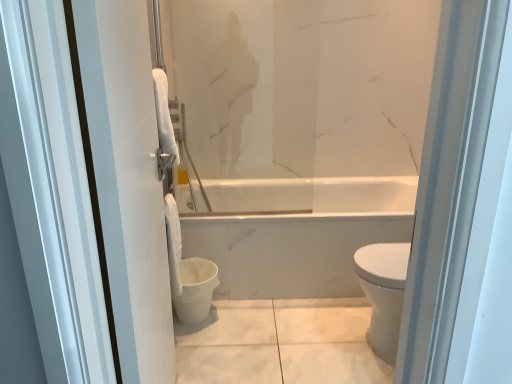
The image size is (512, 384). What are the coordinates of `vacant area situated below white matte toilet bowl at lower center (from a real-world perspective)` in the screenshot? It's located at (194, 321).